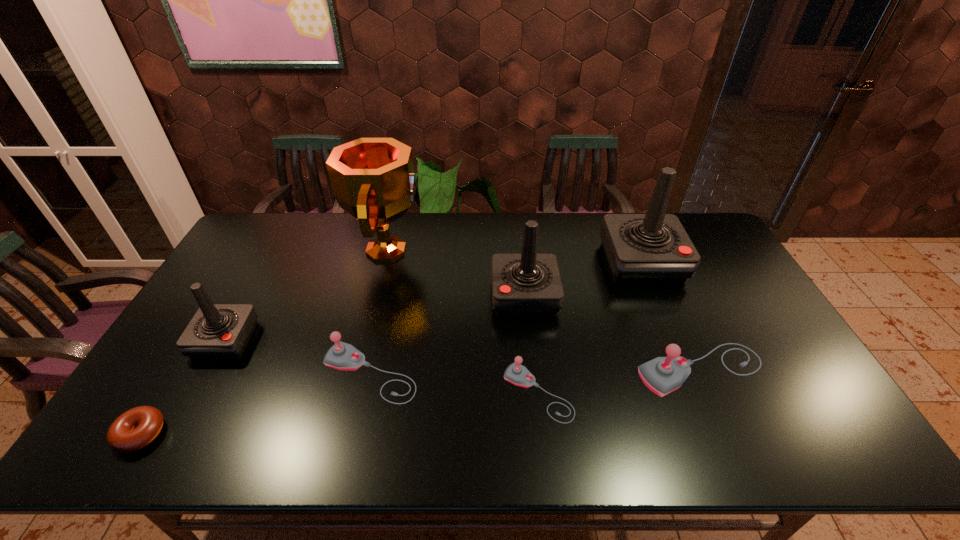
At what (x,y) coordinates should I click in order to perform the action: click on vacant space situated on the front-facing side of the leftmost joystick. Please return your answer as a coordinate pair (x, y). The image size is (960, 540). Looking at the image, I should click on (161, 455).

The width and height of the screenshot is (960, 540). I want to click on free location located 0.240m on the back of the biggest gray joystick, so click(x=662, y=285).

I want to click on vacant space located on the back of the leftmost gray joystick, so click(390, 287).

Where is `free space located on the left of the shortest joystick`? free space located on the left of the shortest joystick is located at coordinates (362, 393).

Find the location of a particular element. free space located on the back of the chocolate doughnut is located at coordinates (186, 360).

Where is `award situated at the far edge`? This screenshot has height=540, width=960. award situated at the far edge is located at coordinates (372, 179).

The width and height of the screenshot is (960, 540). Find the location of `joystick that is positioned at the far edge`. joystick that is positioned at the far edge is located at coordinates (653, 248).

Identify the location of joystick located at the near edge. (517, 374).

Where is `doughnut located in the near edge section of the desktop`? The height and width of the screenshot is (540, 960). doughnut located in the near edge section of the desktop is located at coordinates (134, 429).

Identify the location of joystick located at the left edge. (217, 331).